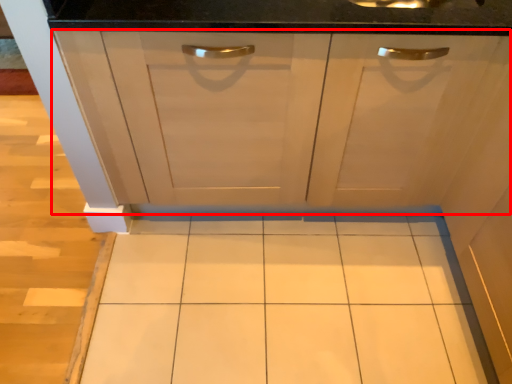
Question: From the image's perspective, where is cabinetry (annotated by the red box) located relative to ceramic tile?

Choices:
 (A) below
 (B) above

Answer: (B)